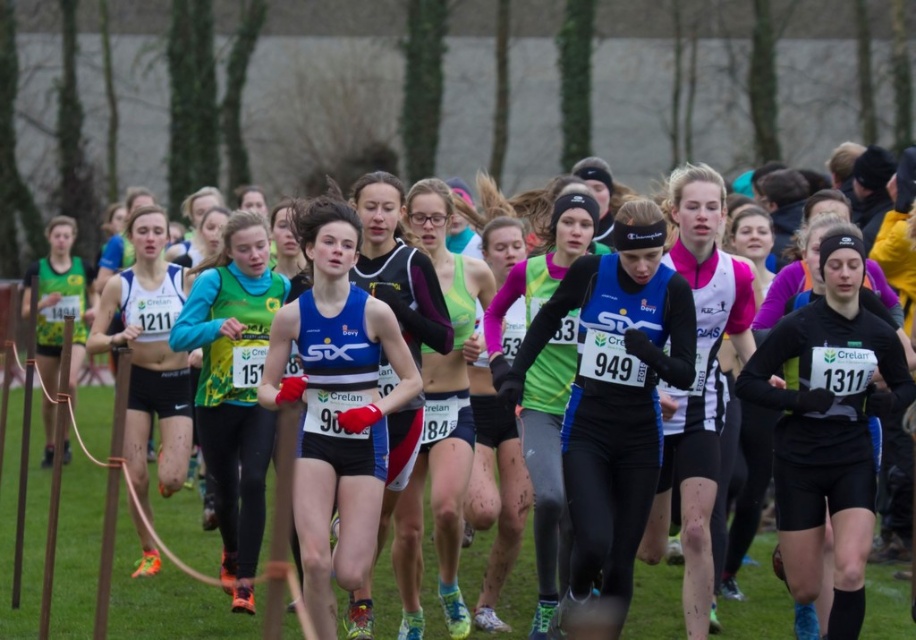
Question: Which object is farther from the camera taking this photo?

Choices:
 (A) blue fabric running suit at center
 (B) black matte running suit at center

Answer: (A)

Question: Is black matte running suit at center further to camera compared to matte blue running suit at center?

Choices:
 (A) no
 (B) yes

Answer: (A)

Question: Is blue synthetic tank top at center to the left of matte black shorts at left from the viewer's perspective?

Choices:
 (A) yes
 (B) no

Answer: (B)

Question: Does black matte running suit at center have a greater width compared to matte blue tank top at center?

Choices:
 (A) yes
 (B) no

Answer: (A)

Question: Among these objects, which one is farthest from the camera?

Choices:
 (A) green jersey at center
 (B) black matte running suit at center
 (C) matte black shorts at left
 (D) pink matte jersey at center

Answer: (C)

Question: Which of the following is the closest to the observer?

Choices:
 (A) matte black running suit at center
 (B) blue fabric running suit at center
 (C) matte blue running suit at center
 (D) black matte running suit at center

Answer: (D)